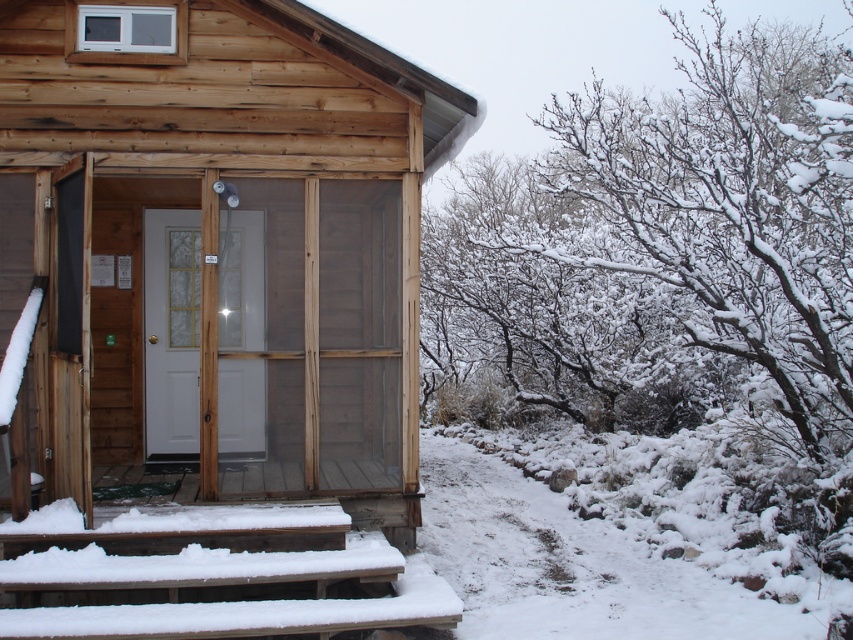
You are standing in front of the wooden cabin and notice a point marked at coordinate (x=676, y=244). Based on the scene description, what object or feature is located at that coordinate?

The point at coordinate (x=676, y=244) marks snow covered branches at upper right.